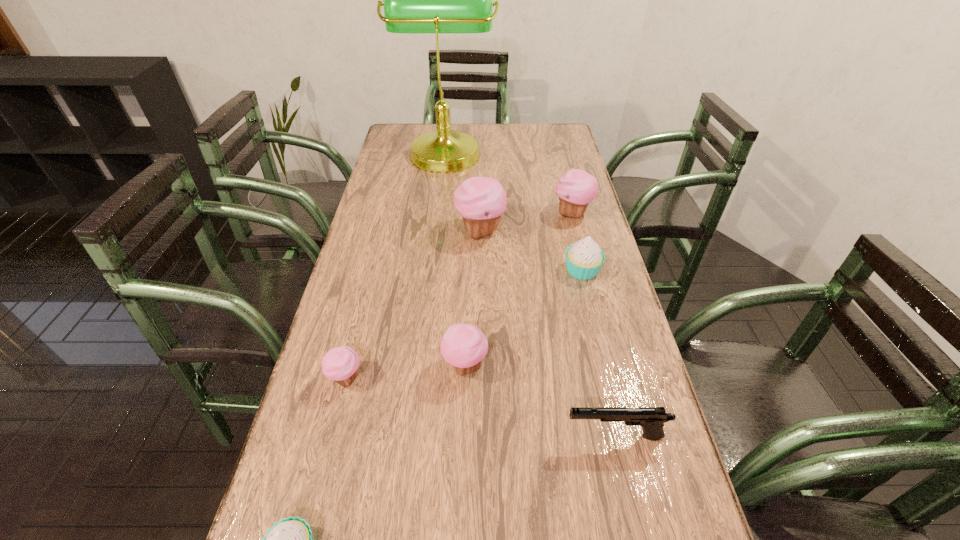
Image resolution: width=960 pixels, height=540 pixels. I want to click on vacant space in between the farthest object and the fifth shortest cupcake, so click(x=509, y=182).

You are a GUI agent. You are given a task and a screenshot of the screen. Output one action in this format:
    pyautogui.click(x=<x>, y=<y>)
    Task: Click on the free point between the sixth shortest object and the farthest object
    The image size is (960, 540).
    Given the screenshot: What is the action you would take?
    pyautogui.click(x=509, y=182)

Where is `free space between the rightmost pink cupcake and the smallest pink cupcake`? free space between the rightmost pink cupcake and the smallest pink cupcake is located at coordinates (459, 296).

Locate an element on the screen. The image size is (960, 540). free space that is in between the third biggest pink cupcake and the right white cupcake is located at coordinates (523, 318).

Locate an element on the screen. empty space that is in between the farther white cupcake and the biggest pink cupcake is located at coordinates (531, 251).

Where is `empty space that is in between the smallest pink cupcake and the gun`? This screenshot has width=960, height=540. empty space that is in between the smallest pink cupcake and the gun is located at coordinates (480, 407).

Locate an element on the screen. This screenshot has height=540, width=960. object identified as the second closest to the green lamp is located at coordinates (481, 201).

You are a GUI agent. You are given a task and a screenshot of the screen. Output one action in this format:
    pyautogui.click(x=<x>, y=<y>)
    Task: Click on the object that ranks as the third closest to the leftmost pink cupcake
    The height and width of the screenshot is (540, 960).
    Given the screenshot: What is the action you would take?
    pyautogui.click(x=652, y=419)

This screenshot has width=960, height=540. I want to click on cupcake that stands as the third closest to the third tallest object, so click(464, 346).

Select which cupcake appears as the second closest to the second nearest object. Please provide its 2D coordinates. Your answer should be formatted as a tuple, i.e. [(x, y)], where the tuple contains the x and y coordinates of a point satisfying the conditions above.

[(584, 259)]